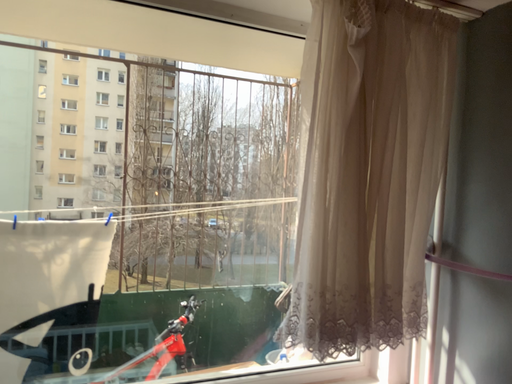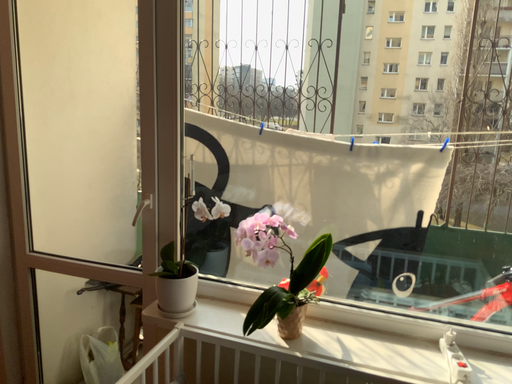
Question: Which way did the camera rotate in the video?

Choices:
 (A) rotated left
 (B) rotated right

Answer: (A)